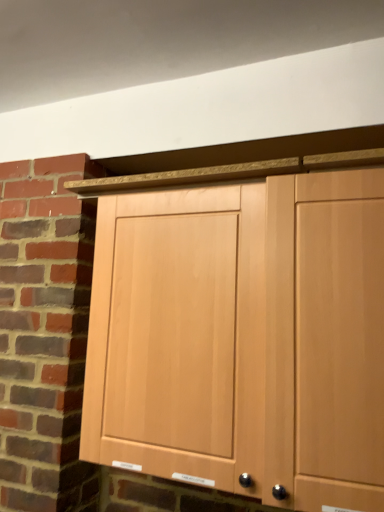
Locate an element on the screen. The width and height of the screenshot is (384, 512). light wood cabinet at center is located at coordinates (292, 288).

What do you see at coordinates (292, 288) in the screenshot? I see `light wood cabinet at center` at bounding box center [292, 288].

Locate an element on the screen. Image resolution: width=384 pixels, height=512 pixels. light wood cabinet at center is located at coordinates (292, 288).